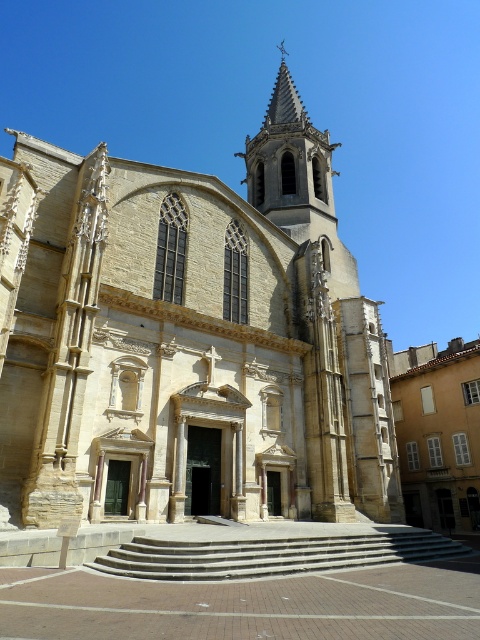
You are standing in front of the historic church and notice two points marked on the bell tower. The first point is located at coordinates point (46, 497) and the second at point (432, 536). Which of these points is situated closer to your current position?

Point (46, 497) is closer to the viewer than point (432, 536).

You are standing at the base of the gray concrete stairs at center, facing the beige stone church at center. Which structure is wider from your perspective?

The beige stone church at center is wider than the gray concrete stairs at center from your perspective.

Based on the scene description, where is the beige stone church at center located in the image? Provide the coordinates as a pair of numbers between 0 and 1, with the first number representing the horizontal position and the second the vertical position.

The beige stone church at center is located at coordinates point (188, 339).